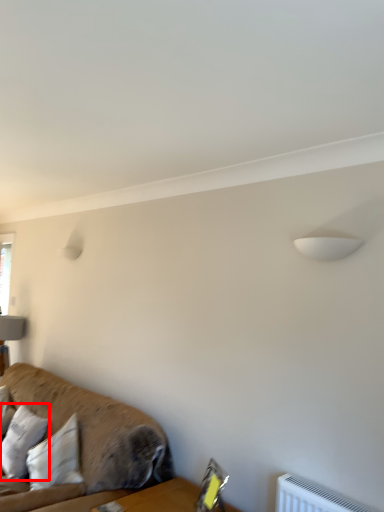
Question: From the image's perspective, what is the correct spatial relationship of pillow (annotated by the red box) in relation to studio couch?

Choices:
 (A) above
 (B) below

Answer: (B)